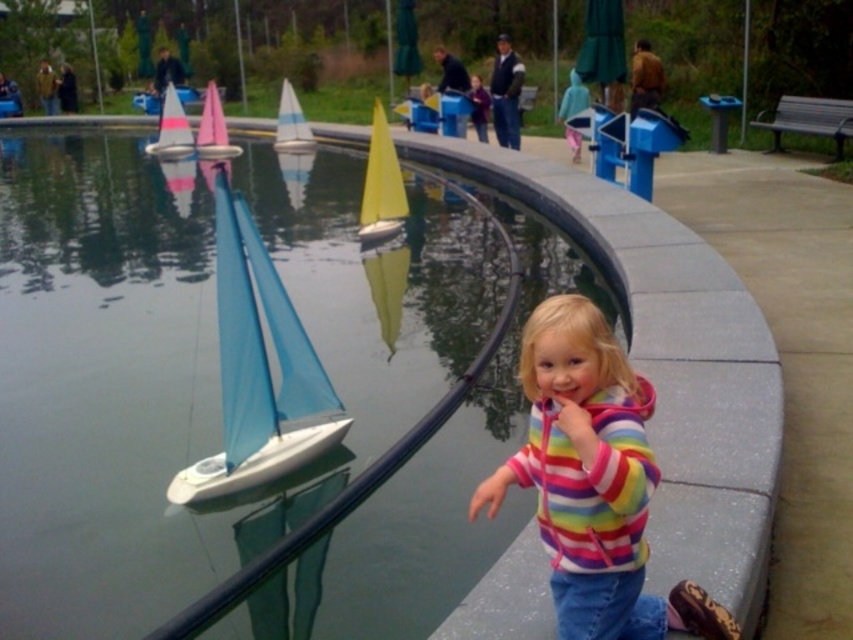
Question: Is blue fabric sailboat at left bigger than matte blue sailboat at left?

Choices:
 (A) yes
 (B) no

Answer: (B)

Question: In this image, where is transparent plastic pool at center located relative to rainbow striped hoodie at lower right?

Choices:
 (A) below
 (B) above

Answer: (B)

Question: Is transparent plastic pool at center wider than blue fabric sailboat at left?

Choices:
 (A) no
 (B) yes

Answer: (B)

Question: Based on their relative distances, which object is nearer to the blue matte sailboat at center?

Choices:
 (A) transparent plastic pool at center
 (B) blue fabric sailboat at left
 (C) matte blue sailboat at left

Answer: (C)

Question: Among these objects, which one is nearest to the camera?

Choices:
 (A) rainbow striped hoodie at lower right
 (B) matte blue sailboat at left
 (C) blue matte sailboat at center

Answer: (A)

Question: Which of the following is the farthest from the observer?

Choices:
 (A) (299, 150)
 (B) (346, 620)
 (C) (212, 99)
 (D) (308, 372)

Answer: (A)